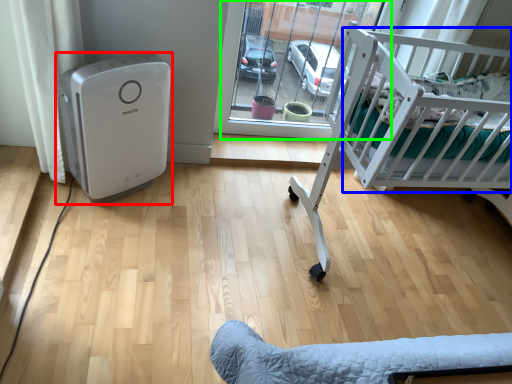
Question: Estimate the real-world distances between objects in this image. Which object is closer to home appliance (highlighted by a red box), infant bed (highlighted by a blue box) or glass door (highlighted by a green box)?

Choices:
 (A) infant bed
 (B) glass door

Answer: (B)